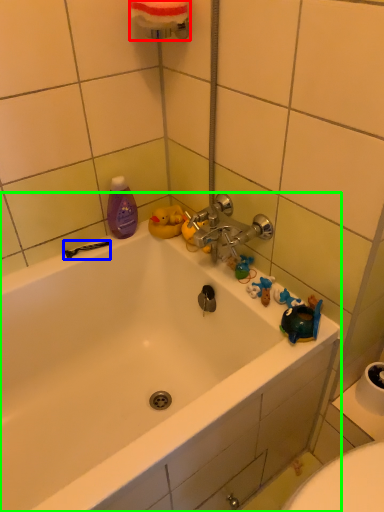
Question: Which object is positioned closest to towel bar (highlighted by a red box)? Select from shower (highlighted by a blue box) and bathtub (highlighted by a green box).

Choices:
 (A) shower
 (B) bathtub

Answer: (A)